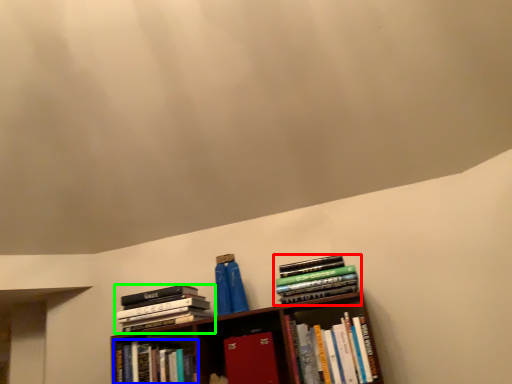
Question: Which object is positioned closest to book (highlighted by a red box)? Select from book (highlighted by a blue box) and book (highlighted by a green box).

Choices:
 (A) book
 (B) book

Answer: (B)